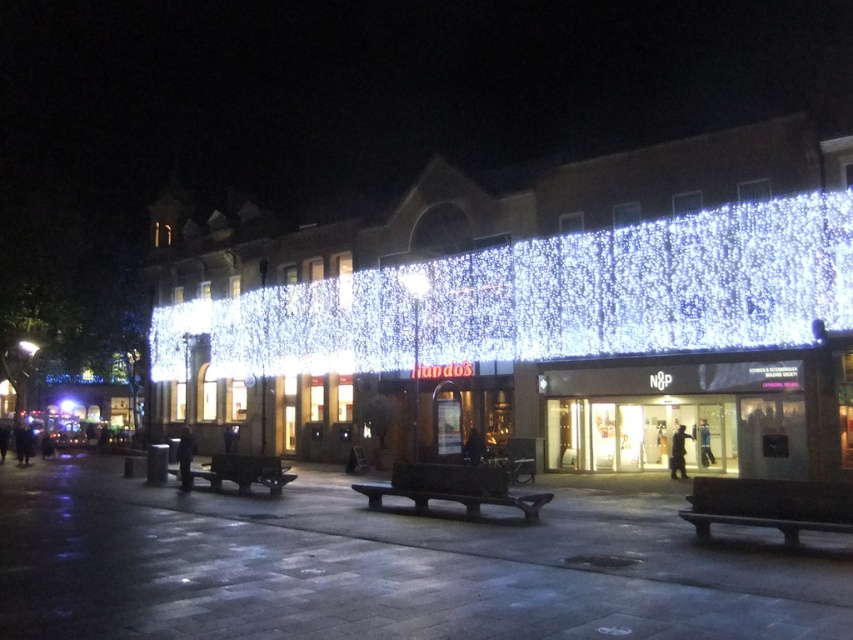
Which is below, illuminated glass facade at center or dark brown wooden bench at center?

Positioned lower is dark brown wooden bench at center.

Consider the image. Does illuminated glass facade at center appear under dark brown wooden bench at center?

No.

Image resolution: width=853 pixels, height=640 pixels. What do you see at coordinates (544, 312) in the screenshot?
I see `illuminated glass facade at center` at bounding box center [544, 312].

The image size is (853, 640). Identify the location of illuminated glass facade at center. (544, 312).

Is black polished bench at lower right thinner than dark brown wooden bench at center?

In fact, black polished bench at lower right might be wider than dark brown wooden bench at center.

Which is behind, point (784, 532) or point (376, 496)?

The point (376, 496) is more distant.

Where is `black polished bench at lower right`? The width and height of the screenshot is (853, 640). black polished bench at lower right is located at coordinates (770, 506).

Consider the image. Who is lower down, illuminated glass facade at center or wooden bench at center?

wooden bench at center

The height and width of the screenshot is (640, 853). Describe the element at coordinates (544, 312) in the screenshot. I see `illuminated glass facade at center` at that location.

Does point (260, 444) lie behind point (180, 474)?

Yes, point (260, 444) is farther from viewer.

The width and height of the screenshot is (853, 640). What are the coordinates of `illuminated glass facade at center` in the screenshot? It's located at (544, 312).